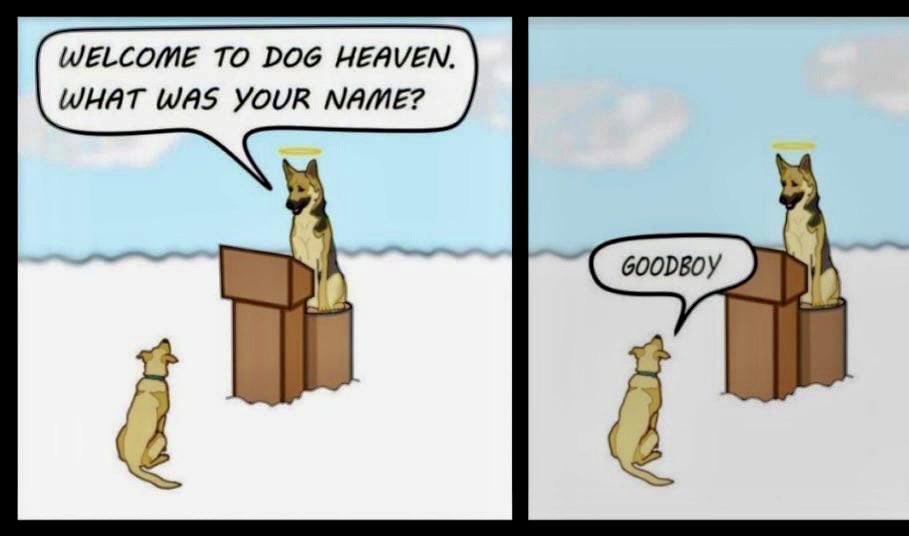
The image size is (909, 536). Identify the location of seat behind podium. (333, 348), (820, 352).